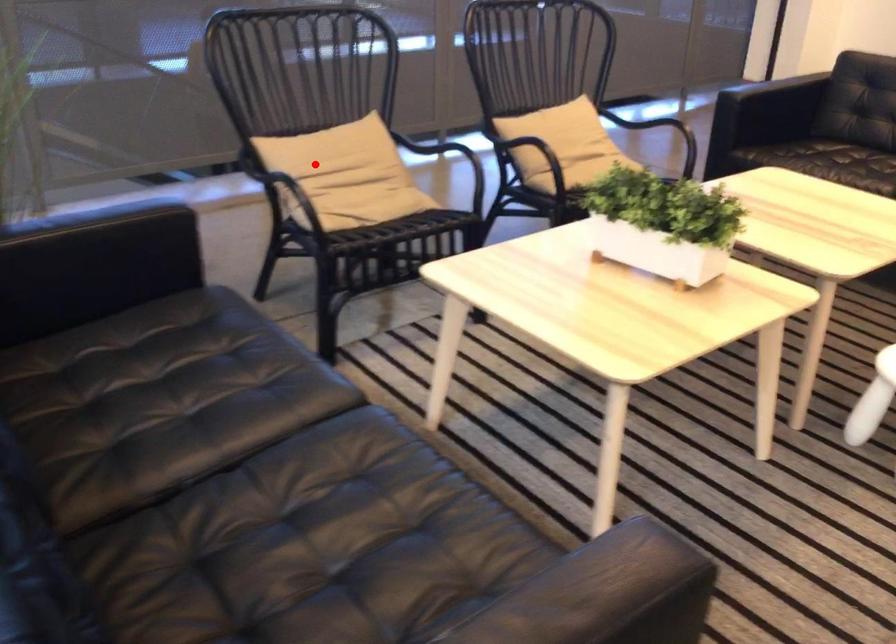
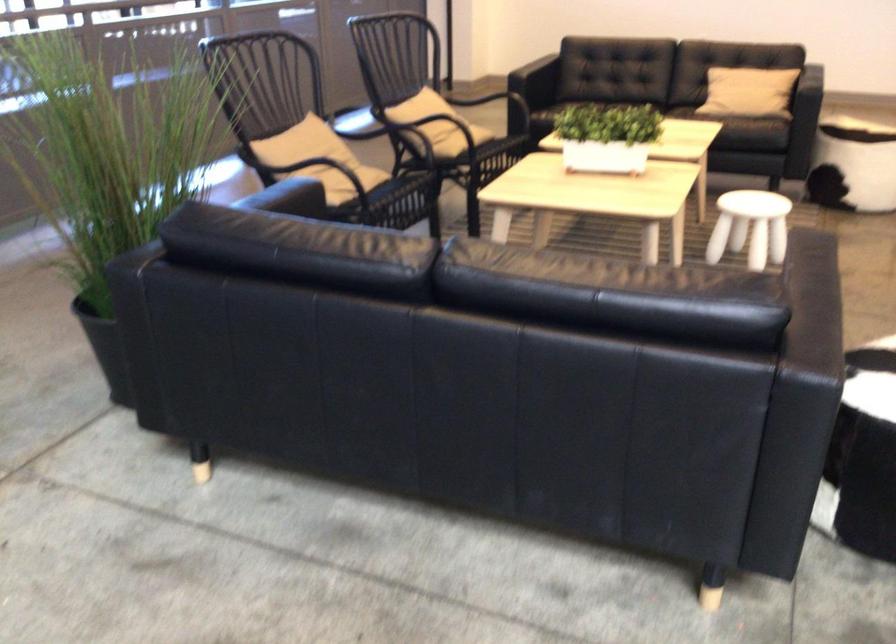
Question: I am providing you with two images of the same scene from different viewpoints. Given a red point in image1, look at the same physical point in image2. Is it:

Choices:
 (A) Closer to the viewpoint
 (B) Farther from the viewpoint

Answer: (B)